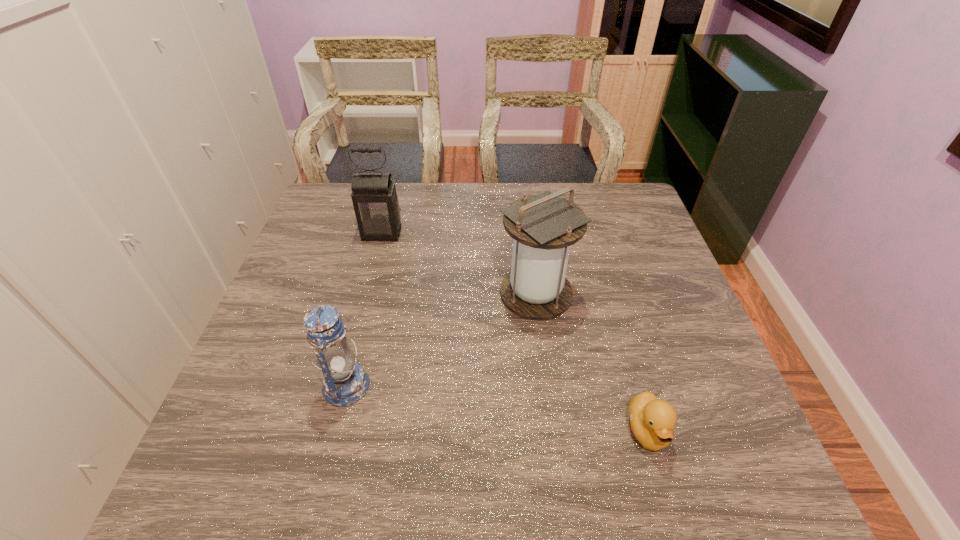
You are a GUI agent. You are given a task and a screenshot of the screen. Output one action in this format:
    pyautogui.click(x=<x>, y=<y>)
    Task: Click on the object at the near edge
    
    Given the screenshot: What is the action you would take?
    pyautogui.click(x=652, y=420)

Find the location of a particular element. This screenshot has width=960, height=540. object that is positioned at the right edge is located at coordinates (652, 420).

The height and width of the screenshot is (540, 960). Identify the location of object at the near right corner. (652, 420).

This screenshot has width=960, height=540. Identify the location of vacant region at the far edge of the desktop. (538, 188).

You are a GUI agent. You are given a task and a screenshot of the screen. Output one action in this format:
    pyautogui.click(x=<x>, y=<y>)
    Task: Click on the free space at the near edge of the desktop
    
    Given the screenshot: What is the action you would take?
    pyautogui.click(x=464, y=463)

Locate an element on the screen. The image size is (960, 540). free space at the left edge of the desktop is located at coordinates (345, 228).

I want to click on vacant space at the right edge, so click(665, 325).

Find the location of a particular element. This screenshot has height=540, width=960. vacant region between the farthest lantern and the second object from right to left is located at coordinates (459, 264).

Image resolution: width=960 pixels, height=540 pixels. I want to click on vacant space that is in between the farthest lantern and the second nearest lantern, so click(x=459, y=264).

Where is `free space that is in between the second farthest object and the nearest lantern`? Image resolution: width=960 pixels, height=540 pixels. free space that is in between the second farthest object and the nearest lantern is located at coordinates (441, 340).